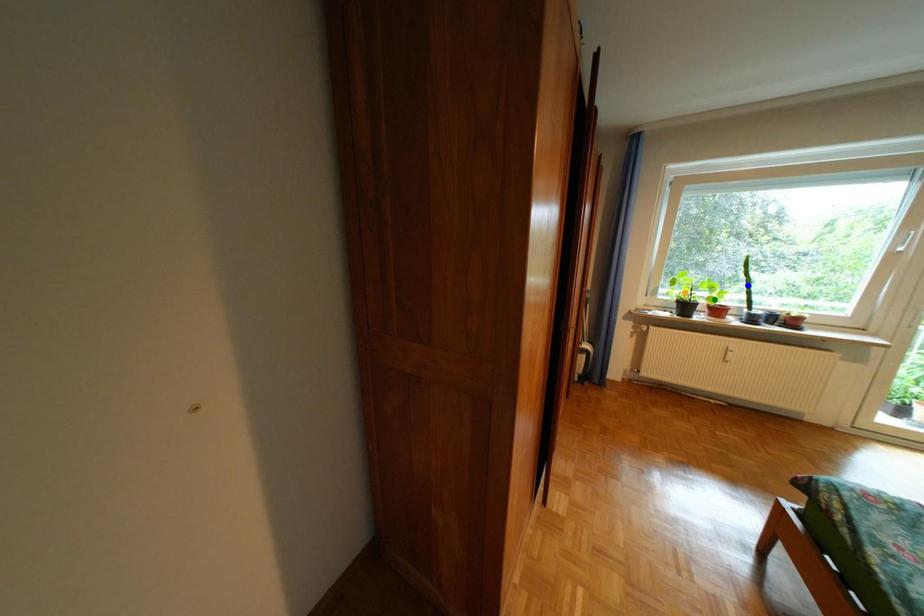
Based on the photo, order these from nearest to farthest:
blue point | orange point | green point

green point, orange point, blue point